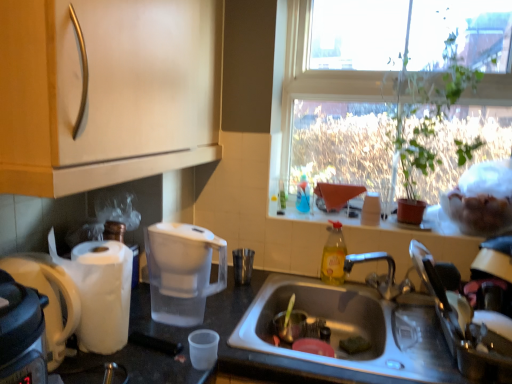
Question: From the image's perspective, is green leafy plant at upper right under transparent glass window at upper right?

Choices:
 (A) yes
 (B) no

Answer: (A)

Question: Is green leafy plant at upper right far away from transparent glass window at upper right?

Choices:
 (A) no
 (B) yes

Answer: (A)

Question: Is green leafy plant at upper right positioned before transparent glass window at upper right?

Choices:
 (A) yes
 (B) no

Answer: (A)

Question: From a real-world perspective, is green leafy plant at upper right under transparent glass window at upper right?

Choices:
 (A) yes
 (B) no

Answer: (A)

Question: Does green leafy plant at upper right turn towards transparent glass window at upper right?

Choices:
 (A) no
 (B) yes

Answer: (A)

Question: In the image, is green leafy plant at upper right positioned in front of or behind stainless steel sink at lower center?

Choices:
 (A) behind
 (B) front

Answer: (A)

Question: From a real-world perspective, is green leafy plant at upper right positioned above or below stainless steel sink at lower center?

Choices:
 (A) above
 (B) below

Answer: (A)

Question: From the image's perspective, is green leafy plant at upper right positioned above or below stainless steel sink at lower center?

Choices:
 (A) above
 (B) below

Answer: (A)

Question: Is point (433, 100) positioned closer to the camera than point (308, 291)?

Choices:
 (A) closer
 (B) farther

Answer: (A)

Question: Considering the positions of matte wood cabinet at upper left and transparent plastic water filter at center, marked as the first coffee maker in a right-to-left arrangement, in the image, is matte wood cabinet at upper left wider or thinner than transparent plastic water filter at center, marked as the first coffee maker in a right-to-left arrangement,?

Choices:
 (A) thin
 (B) wide

Answer: (B)

Question: Considering the relative positions of matte wood cabinet at upper left and transparent plastic water filter at center, positioned as the second coffee maker in left-to-right order, in the image provided, is matte wood cabinet at upper left to the left or to the right of transparent plastic water filter at center, positioned as the second coffee maker in left-to-right order,?

Choices:
 (A) left
 (B) right

Answer: (A)

Question: In terms of size, does matte wood cabinet at upper left appear bigger or smaller than transparent plastic water filter at center, marked as the first coffee maker in a right-to-left arrangement?

Choices:
 (A) big
 (B) small

Answer: (A)

Question: Do you think matte wood cabinet at upper left is within transparent plastic water filter at center, positioned as the second coffee maker in left-to-right order, or outside of it?

Choices:
 (A) inside
 (B) outside

Answer: (B)

Question: In the image, is transparent plastic cup at lower center, which is the 1th coffee cup from bottom to top, positioned in front of or behind brushed metal cup at sink, the second coffee cup when ordered from front to back?

Choices:
 (A) behind
 (B) front

Answer: (B)

Question: Visually, is transparent plastic cup at lower center, which is counted as the second coffee cup, starting from the right, positioned to the left or to the right of brushed metal cup at sink, marked as the first coffee cup in a right-to-left arrangement?

Choices:
 (A) right
 (B) left

Answer: (B)